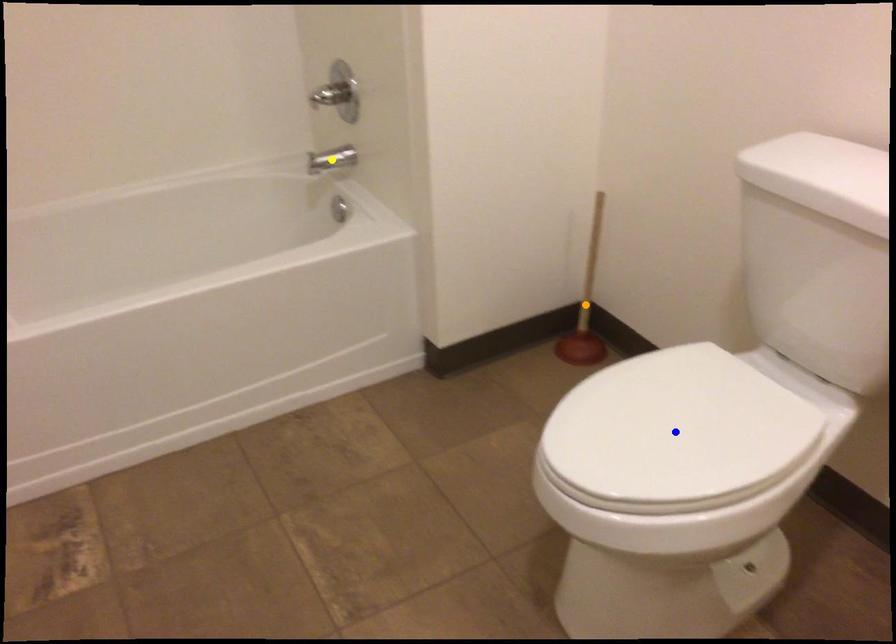
Order these from nearest to farthest:
A) yellow point
B) orange point
C) blue point

orange point → yellow point → blue point